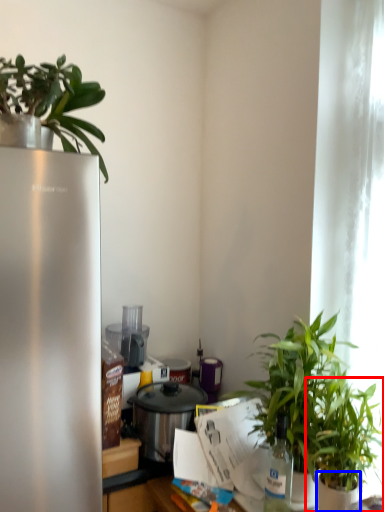
Question: Which point is closer to the camera, houseplant (highlighted by a red box) or flowerpot (highlighted by a blue box)?

Choices:
 (A) houseplant
 (B) flowerpot

Answer: (B)